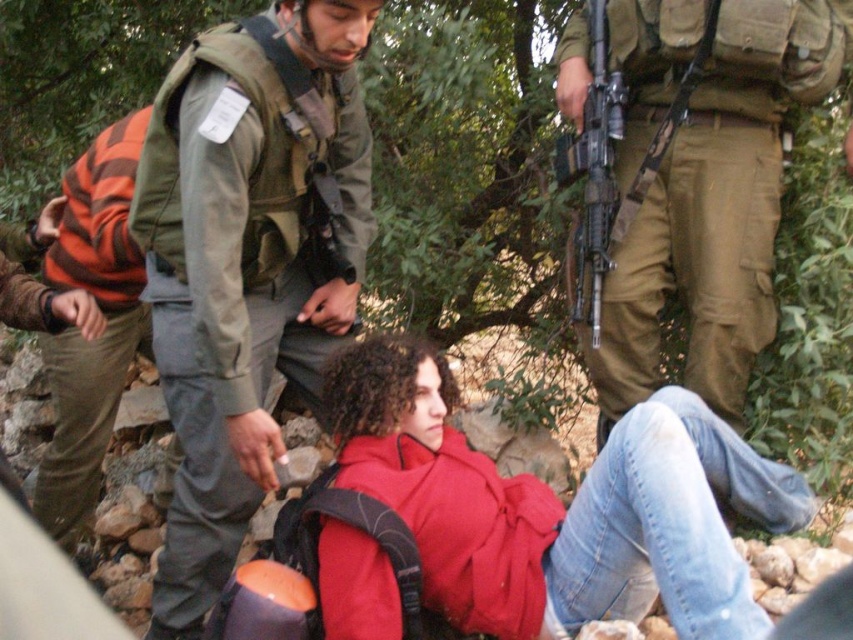
Question: Which object is positioned farthest from the striped cotton shirt at left?

Choices:
 (A) green military uniform at center
 (B) matte black rifle at center
 (C) camouflage fabric uniform at center

Answer: (C)

Question: Which of the following is the farthest from the observer?

Choices:
 (A) (792, 83)
 (B) (50, 364)
 (C) (602, 490)
 (D) (254, 356)

Answer: (B)

Question: Where is red matte jacket at lower center located in relation to matte black rifle at center in the image?

Choices:
 (A) above
 (B) below

Answer: (B)

Question: Which point is farther to the camera?

Choices:
 (A) striped cotton shirt at left
 (B) red matte jacket at lower center

Answer: (A)

Question: From the image, what is the correct spatial relationship of green military uniform at center in relation to camouflage fabric uniform at center?

Choices:
 (A) left
 (B) right

Answer: (A)

Question: Observing the image, what is the correct spatial positioning of green military uniform at center in reference to striped cotton shirt at left?

Choices:
 (A) above
 (B) below

Answer: (A)